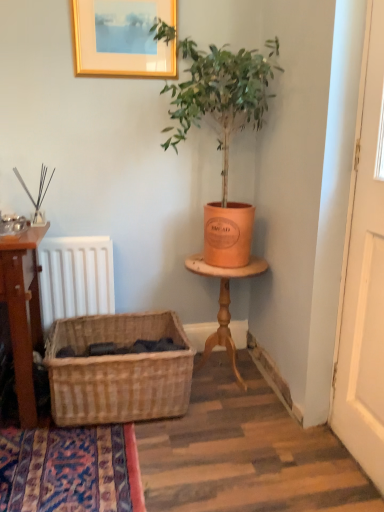
Where is `vacant space that is in between wooden table at right and white wooden door at right`? Image resolution: width=384 pixels, height=512 pixels. vacant space that is in between wooden table at right and white wooden door at right is located at coordinates (286, 426).